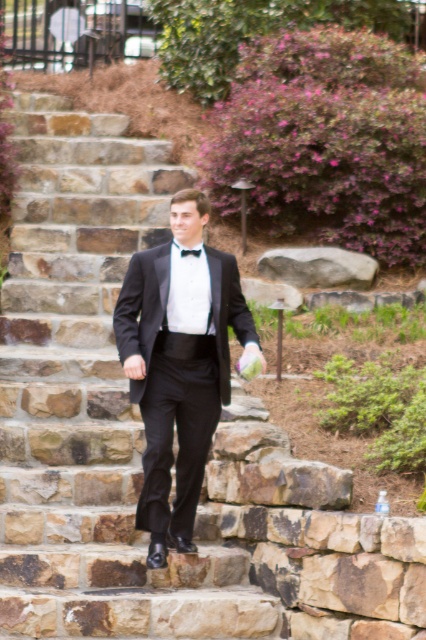
You are standing at the bottom of the stone steps and want to walk to the point marked as point (23, 316). However, there is an obstacle at point (198, 257). Will you be able to see the obstacle from your current position?

Yes, because point (198, 257) is in front of point (23, 316), so the obstacle at point (198, 257) will be visible from your current position at the bottom of the stone steps.

You are standing at the bottom of the stone steps and want to reach the point marked as point (x=92, y=401). Can you walk directly to it without stepping on any plants?

The point (x=92, y=401) is located on the smooth stone stairs at center, so yes, you can walk directly to it without stepping on any plants since the stairs provide a clear path.

You are a fashion designer observing a man dressed in formal wear. You notice the black satin tuxedo at center and the black satin bow tie at center. Which piece of clothing is located lower on the man?

The black satin tuxedo at center is positioned under the black satin bow tie at center, so the tuxedo is lower on the man.